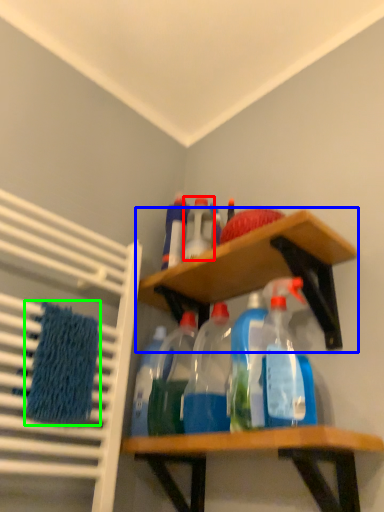
Question: Based on their relative distances, which object is farther from bottle (highlighted by a red box)? Choose from shelf (highlighted by a blue box) and bath towel (highlighted by a green box).

Choices:
 (A) shelf
 (B) bath towel

Answer: (B)